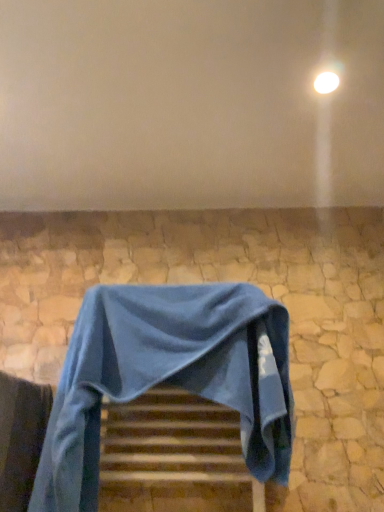
Question: Can you confirm if matte white wall at upper center is positioned to the right of white glossy light at upper right?

Choices:
 (A) no
 (B) yes

Answer: (A)

Question: Can you confirm if matte white wall at upper center is bigger than white glossy light at upper right?

Choices:
 (A) yes
 (B) no

Answer: (A)

Question: Does matte white wall at upper center have a smaller size compared to white glossy light at upper right?

Choices:
 (A) no
 (B) yes

Answer: (A)

Question: Does matte white wall at upper center have a lesser height compared to white glossy light at upper right?

Choices:
 (A) yes
 (B) no

Answer: (B)

Question: Is matte white wall at upper center oriented away from white glossy light at upper right?

Choices:
 (A) no
 (B) yes

Answer: (A)

Question: Considering the positions of point (342, 91) and point (211, 369), is point (342, 91) closer or farther from the camera than point (211, 369)?

Choices:
 (A) closer
 (B) farther

Answer: (B)

Question: Is matte white wall at upper center in front of or behind blue fabric chair at center in the image?

Choices:
 (A) behind
 (B) front

Answer: (B)

Question: Based on their positions, is matte white wall at upper center located to the left or right of blue fabric chair at center?

Choices:
 (A) right
 (B) left

Answer: (A)

Question: Is matte white wall at upper center taller or shorter than blue fabric chair at center?

Choices:
 (A) tall
 (B) short

Answer: (B)

Question: Considering the positions of blue fabric chair at center and wooden stairs at center in the image, is blue fabric chair at center wider or thinner than wooden stairs at center?

Choices:
 (A) thin
 (B) wide

Answer: (B)

Question: From the image's perspective, is blue fabric chair at center positioned above or below wooden stairs at center?

Choices:
 (A) below
 (B) above

Answer: (B)

Question: Would you say blue fabric chair at center is inside or outside wooden stairs at center?

Choices:
 (A) inside
 (B) outside

Answer: (B)

Question: From a real-world perspective, is blue fabric chair at center above or below wooden stairs at center?

Choices:
 (A) below
 (B) above

Answer: (B)

Question: Choose the correct answer: Is matte white wall at upper center inside wooden stairs at center or outside it?

Choices:
 (A) inside
 (B) outside

Answer: (B)

Question: Considering the relative positions of matte white wall at upper center and wooden stairs at center in the image provided, is matte white wall at upper center to the left or to the right of wooden stairs at center?

Choices:
 (A) left
 (B) right

Answer: (B)